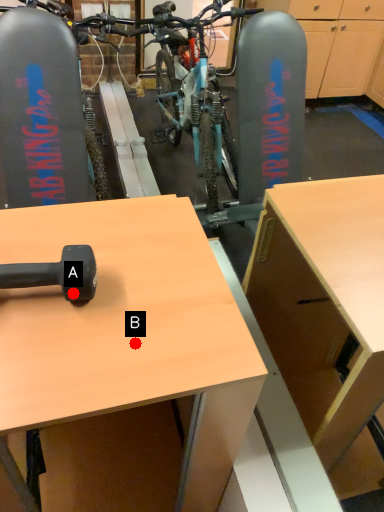
Question: Two points are circled on the image, labeled by A and B beside each circle. Which point is further to the camera?

Choices:
 (A) A is further
 (B) B is further

Answer: (A)